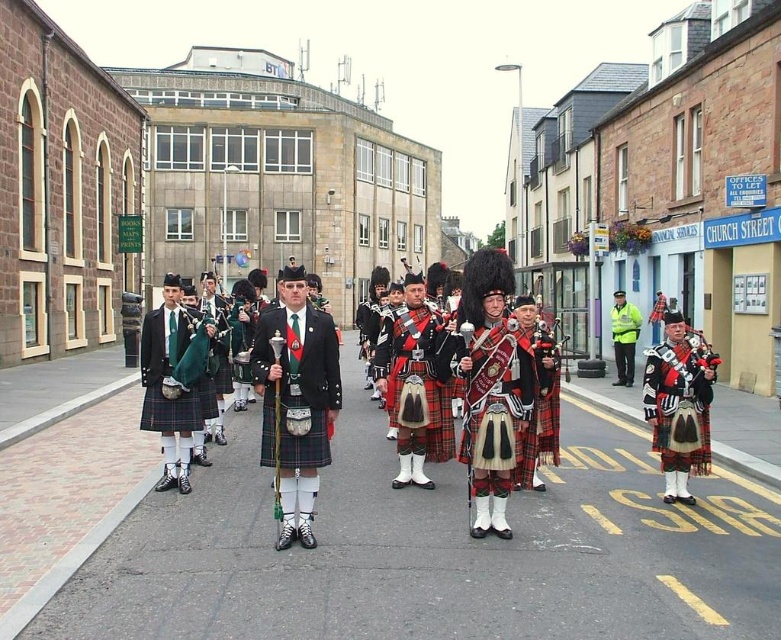
You are standing at the center of the street and see the point marked at coordinates (679, 404). What object is located at that point?

The point at coordinates (679, 404) marks the location of the red tartan kilt at center.

You are standing at the origin point in the image. There is a red tartan kilt at center. Can you tell me what object is located at the coordinate point (679, 404)?

The point (679, 404) corresponds to the red tartan kilt at center.